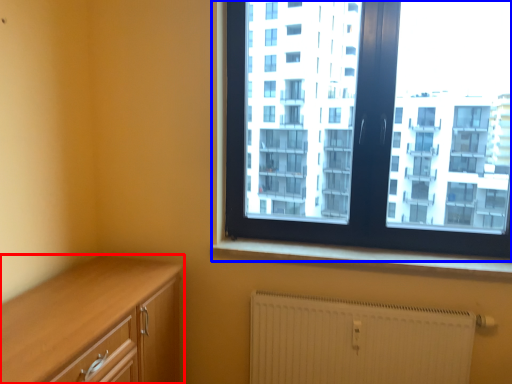
Question: Which of the following is the farthest to the observer, cabinetry (highlighted by a red box) or window (highlighted by a blue box)?

Choices:
 (A) cabinetry
 (B) window

Answer: (B)